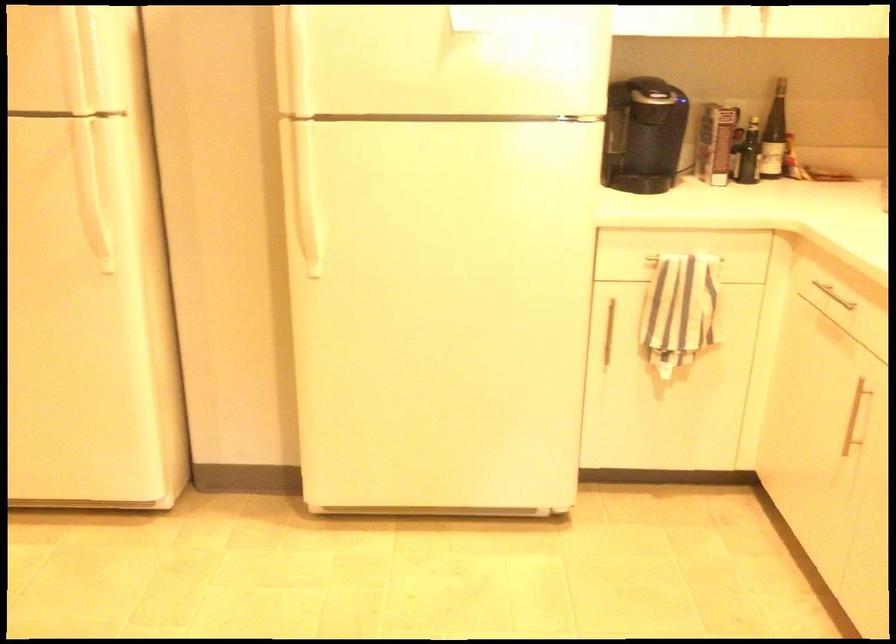
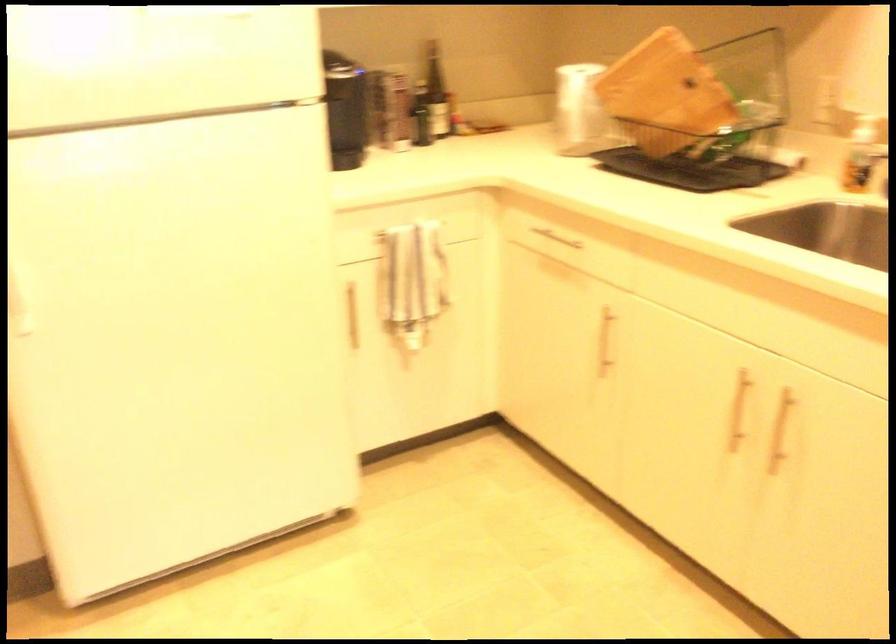
Locate, in the second image, the point that corresponds to (778,134) in the first image.

(435, 91)